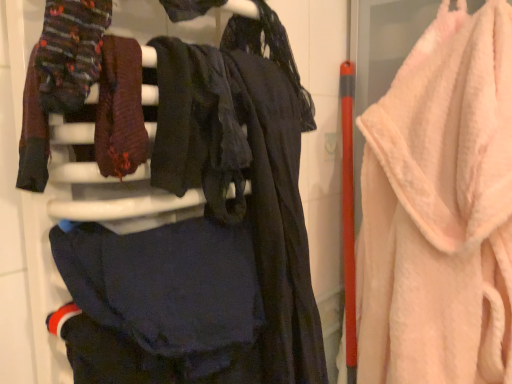
Question: Do you think knitted wool socks at upper left, arranged as the 1th clothing when viewed from the top, is within pink fluffy towel at right, or outside of it?

Choices:
 (A) outside
 (B) inside

Answer: (A)

Question: From a real-world perspective, is knitted wool socks at upper left, which is counted as the 2th clothing, starting from the bottom, positioned above or below pink fluffy towel at right?

Choices:
 (A) below
 (B) above

Answer: (B)

Question: Which is nearer to the pink fluffy towel at right?

Choices:
 (A) dark matte fabric at center, the 2th clothing in the top-to-bottom sequence
 (B) knitted wool socks at upper left, which is counted as the 2th clothing, starting from the bottom
 (C) velvet black dress at center

Answer: (C)

Question: Which of these objects is positioned closest to the pink fluffy towel at right?

Choices:
 (A) velvet black dress at center
 (B) dark matte fabric at center, which ranks as the 1th clothing in bottom-to-top order
 (C) knitted wool socks at upper left, arranged as the 1th clothing when viewed from the top

Answer: (A)